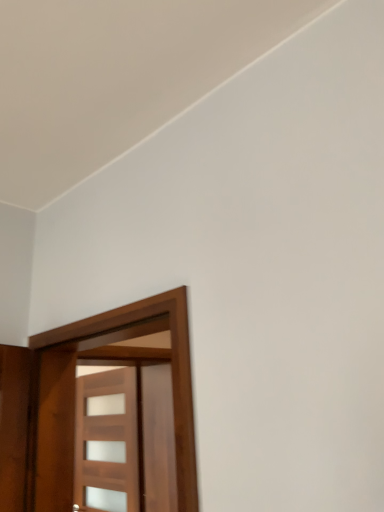
Describe the element at coordinates (73, 395) in the screenshot. I see `wooden door at left, which is the 2th door in back-to-front order` at that location.

Find the location of a particular element. Image resolution: width=384 pixels, height=512 pixels. wooden door at left, which is the 2th door in back-to-front order is located at coordinates (73, 395).

What are the coordinates of `wooden door at center, positioned as the 2th door in front-to-back order` in the screenshot? It's located at (107, 441).

What do you see at coordinates (107, 441) in the screenshot? I see `wooden door at center, positioned as the 2th door in front-to-back order` at bounding box center [107, 441].

I want to click on wooden door at left, which is the 2th door in back-to-front order, so click(x=73, y=395).

Does wooden door at center, which ranks as the 1th door in back-to-front order, appear on the right side of wooden door at left, which is the 2th door in back-to-front order?

In fact, wooden door at center, which ranks as the 1th door in back-to-front order, is to the left of wooden door at left, which is the 2th door in back-to-front order.

Is wooden door at center, which ranks as the 1th door in back-to-front order, in front of or behind wooden door at left, which is the 1th door from front to back, in the image?

wooden door at center, which ranks as the 1th door in back-to-front order, is behind wooden door at left, which is the 1th door from front to back.

Is point (103, 497) closer or farther from the camera than point (191, 402)?

Point (103, 497).

From the image's perspective, which is above, wooden door at center, which ranks as the 1th door in back-to-front order, or wooden door at left, which is the 1th door from front to back?

wooden door at left, which is the 1th door from front to back.

From a real-world perspective, is wooden door at center, positioned as the 2th door in front-to-back order, over wooden door at left, which is the 2th door in back-to-front order?

Actually, wooden door at center, positioned as the 2th door in front-to-back order, is physically below wooden door at left, which is the 2th door in back-to-front order, in the real world.

Between wooden door at center, which ranks as the 1th door in back-to-front order, and wooden door at left, which is the 1th door from front to back, which one has larger width?

With larger width is wooden door at left, which is the 1th door from front to back.

Can you confirm if wooden door at center, positioned as the 2th door in front-to-back order, is taller than wooden door at left, which is the 2th door in back-to-front order?

Indeed, wooden door at center, positioned as the 2th door in front-to-back order, has a greater height compared to wooden door at left, which is the 2th door in back-to-front order.

Considering the sizes of objects wooden door at center, which ranks as the 1th door in back-to-front order, and wooden door at left, which is the 1th door from front to back, in the image provided, who is smaller, wooden door at center, which ranks as the 1th door in back-to-front order, or wooden door at left, which is the 1th door from front to back,?

wooden door at center, which ranks as the 1th door in back-to-front order, is smaller.

Is wooden door at center, which ranks as the 1th door in back-to-front order, positioned beyond the bounds of wooden door at left, which is the 1th door from front to back?

Absolutely, wooden door at center, which ranks as the 1th door in back-to-front order, is external to wooden door at left, which is the 1th door from front to back.

Is wooden door at center, which ranks as the 1th door in back-to-front order, far from wooden door at left, which is the 2th door in back-to-front order?

Yes, wooden door at center, which ranks as the 1th door in back-to-front order, and wooden door at left, which is the 2th door in back-to-front order, are quite far apart.

Is wooden door at center, which ranks as the 1th door in back-to-front order, oriented away from wooden door at left, which is the 2th door in back-to-front order?

No, wooden door at center, which ranks as the 1th door in back-to-front order,'s orientation is not away from wooden door at left, which is the 2th door in back-to-front order.

How many degrees apart are the facing directions of wooden door at center, which ranks as the 1th door in back-to-front order, and wooden door at left, which is the 1th door from front to back?

The angle between the facing direction of wooden door at center, which ranks as the 1th door in back-to-front order, and the facing direction of wooden door at left, which is the 1th door from front to back, is 95.7 degrees.

Measure the distance between wooden door at center, positioned as the 2th door in front-to-back order, and wooden door at left, which is the 1th door from front to back.

wooden door at center, positioned as the 2th door in front-to-back order, is 4.34 feet from wooden door at left, which is the 1th door from front to back.

Locate an element on the screen. This screenshot has height=512, width=384. door lying on the left of wooden door at left, which is the 2th door in back-to-front order is located at coordinates (107, 441).

Consider the image. Which is more to the left, wooden door at left, which is the 2th door in back-to-front order, or wooden door at center, positioned as the 2th door in front-to-back order?

Positioned to the left is wooden door at center, positioned as the 2th door in front-to-back order.

Does wooden door at left, which is the 1th door from front to back, lie behind wooden door at center, positioned as the 2th door in front-to-back order?

That is False.

Is point (179, 383) less distant than point (122, 449)?

Yes, it is in front of point (122, 449).

From the image's perspective, is wooden door at left, which is the 1th door from front to back, beneath wooden door at center, which ranks as the 1th door in back-to-front order?

No.

From a real-world perspective, is wooden door at left, which is the 2th door in back-to-front order, physically located above or below wooden door at center, positioned as the 2th door in front-to-back order?

In terms of real-world spatial position, wooden door at left, which is the 2th door in back-to-front order, is above wooden door at center, positioned as the 2th door in front-to-back order.

Does wooden door at left, which is the 1th door from front to back, have a greater width compared to wooden door at center, which ranks as the 1th door in back-to-front order?

Yes, wooden door at left, which is the 1th door from front to back, is wider than wooden door at center, which ranks as the 1th door in back-to-front order.

Considering the relative sizes of wooden door at left, which is the 1th door from front to back, and wooden door at center, positioned as the 2th door in front-to-back order, in the image provided, is wooden door at left, which is the 1th door from front to back, taller than wooden door at center, positioned as the 2th door in front-to-back order,?

In fact, wooden door at left, which is the 1th door from front to back, may be shorter than wooden door at center, positioned as the 2th door in front-to-back order.

In terms of size, does wooden door at left, which is the 2th door in back-to-front order, appear bigger or smaller than wooden door at center, which ranks as the 1th door in back-to-front order?

Clearly, wooden door at left, which is the 2th door in back-to-front order, is larger in size than wooden door at center, which ranks as the 1th door in back-to-front order.

Is wooden door at left, which is the 2th door in back-to-front order, situated inside wooden door at center, which ranks as the 1th door in back-to-front order, or outside?

wooden door at left, which is the 2th door in back-to-front order, cannot be found inside wooden door at center, which ranks as the 1th door in back-to-front order.

Is wooden door at left, which is the 2th door in back-to-front order, beside wooden door at center, which ranks as the 1th door in back-to-front order?

wooden door at left, which is the 2th door in back-to-front order, and wooden door at center, which ranks as the 1th door in back-to-front order, are clearly separated.

Is wooden door at left, which is the 2th door in back-to-front order, looking in the opposite direction of wooden door at center, which ranks as the 1th door in back-to-front order?

That's right, wooden door at left, which is the 2th door in back-to-front order, is facing away from wooden door at center, which ranks as the 1th door in back-to-front order.

Can you tell me how much wooden door at left, which is the 1th door from front to back, and wooden door at center, positioned as the 2th door in front-to-back order, differ in facing direction?

The facing directions of wooden door at left, which is the 1th door from front to back, and wooden door at center, positioned as the 2th door in front-to-back order, are 95.7 degrees apart.

How far apart are wooden door at left, which is the 1th door from front to back, and wooden door at center, positioned as the 2th door in front-to-back order?

A distance of 1.32 meters exists between wooden door at left, which is the 1th door from front to back, and wooden door at center, positioned as the 2th door in front-to-back order.

This screenshot has width=384, height=512. Identify the location of door behind the wooden door at left, which is the 2th door in back-to-front order. (107, 441).

Locate an element on the screen. This screenshot has width=384, height=512. door on the left of wooden door at left, which is the 2th door in back-to-front order is located at coordinates (107, 441).

Identify the location of door above the wooden door at center, which ranks as the 1th door in back-to-front order (from the image's perspective). The height and width of the screenshot is (512, 384). (73, 395).